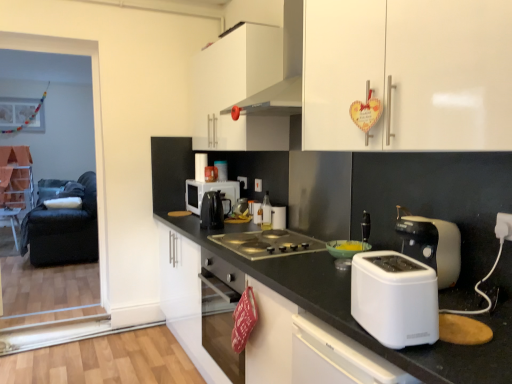
Where is `free region on the left part of white plastic bowl at center, the first appliance in the right-to-left sequence`? free region on the left part of white plastic bowl at center, the first appliance in the right-to-left sequence is located at coordinates (310, 258).